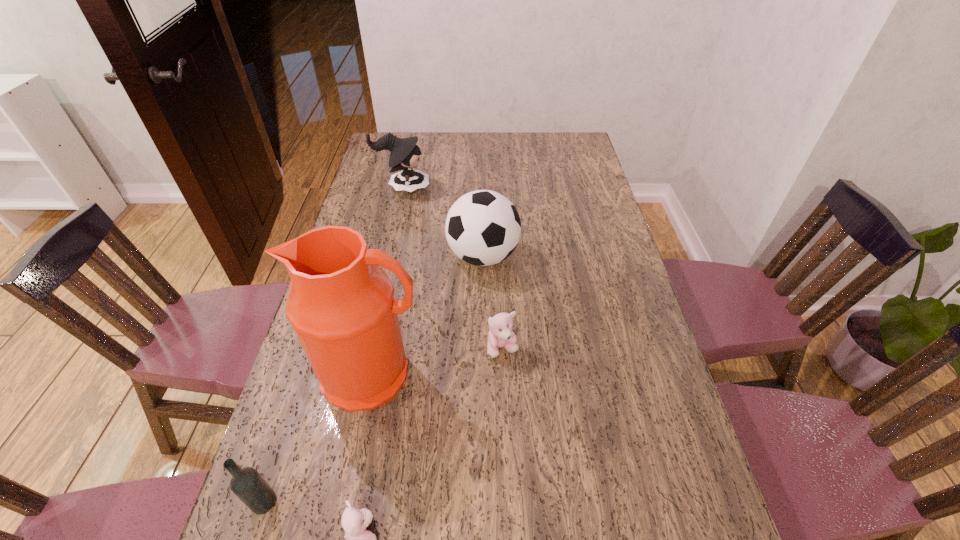
This screenshot has height=540, width=960. In order to click on vacant place for an extra teddy bear on the right in this screenshot , I will do `click(584, 242)`.